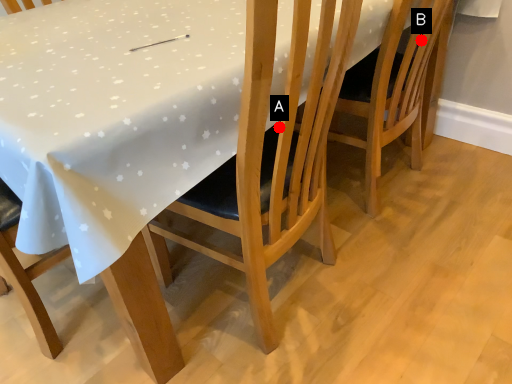
Question: Two points are circled on the image, labeled by A and B beside each circle. Among these points, which one is nearest to the camera?

Choices:
 (A) A is closer
 (B) B is closer

Answer: (A)